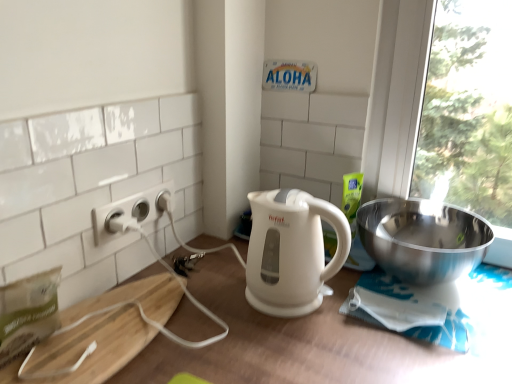
Find the location of a particular element. This screenshot has width=512, height=384. vacant space positioned to the left of white glossy electric kettle at center is located at coordinates (231, 292).